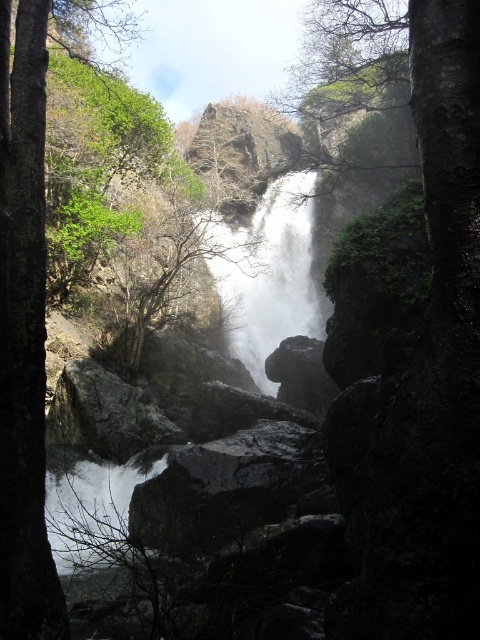
Question: Is the position of dark gray rock at center more distant than that of white smooth waterfall at center?

Choices:
 (A) no
 (B) yes

Answer: (A)

Question: Which point is farther to the camera?

Choices:
 (A) (288, 221)
 (B) (69, 369)
 (C) (283, 429)

Answer: (A)

Question: Which object appears closest to the camera in this image?

Choices:
 (A) rough textured rock at center
 (B) white smooth waterfall at center

Answer: (A)

Question: Can you confirm if white smooth waterfall at center is wider than rough textured rock at center?

Choices:
 (A) yes
 (B) no

Answer: (A)

Question: Which point is farther to the camera?

Choices:
 (A) (292, 288)
 (B) (298, 481)

Answer: (A)

Question: Is dark gray rock at center bigger than white smooth waterfall at center?

Choices:
 (A) yes
 (B) no

Answer: (B)